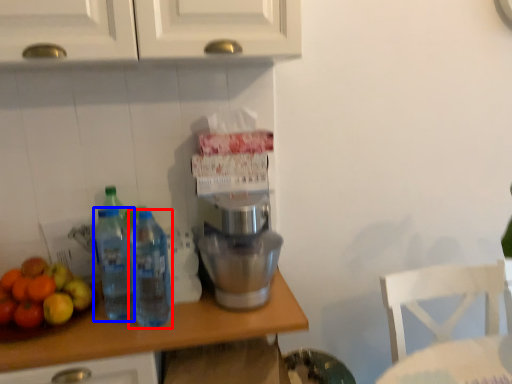
Question: Which object is further to the camera taking this photo, bottle (highlighted by a red box) or bottle (highlighted by a blue box)?

Choices:
 (A) bottle
 (B) bottle

Answer: (B)